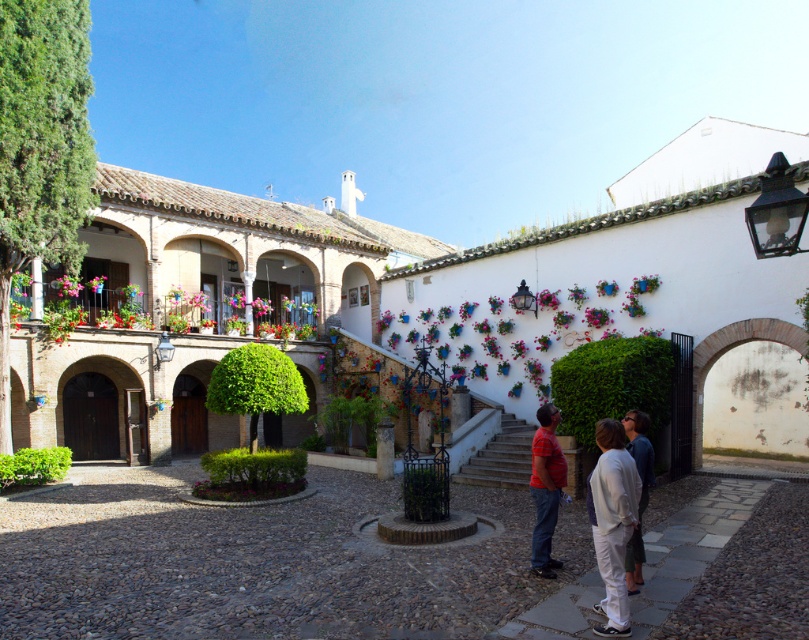
Which of these two, matte red shirt at center or dark blue shirt at center, stands taller?

Standing taller between the two is matte red shirt at center.

Is point (553, 493) farther from viewer compared to point (634, 424)?

Yes.

At what (x,y) coordinates should I click in order to perform the action: click on matte red shirt at center. Please return your answer as a coordinate pair (x, y). Looking at the image, I should click on (545, 488).

Is white cotton pants at lower right shorter than matte red shirt at center?

Correct, white cotton pants at lower right is not as tall as matte red shirt at center.

Between white cotton pants at lower right and matte red shirt at center, which one is positioned lower?

matte red shirt at center is lower down.

Does point (629, 474) lie in front of point (557, 458)?

Yes, it is in front of point (557, 458).

Locate an element on the screen. white cotton pants at lower right is located at coordinates (612, 522).

Is white cotton pants at lower right closer to the viewer compared to dark blue shirt at center?

That is True.

Describe the element at coordinates (612, 522) in the screenshot. I see `white cotton pants at lower right` at that location.

Is point (602, 605) closer to camera compared to point (632, 560)?

That is True.

The image size is (809, 640). In order to click on white cotton pants at lower right in this screenshot , I will do `click(612, 522)`.